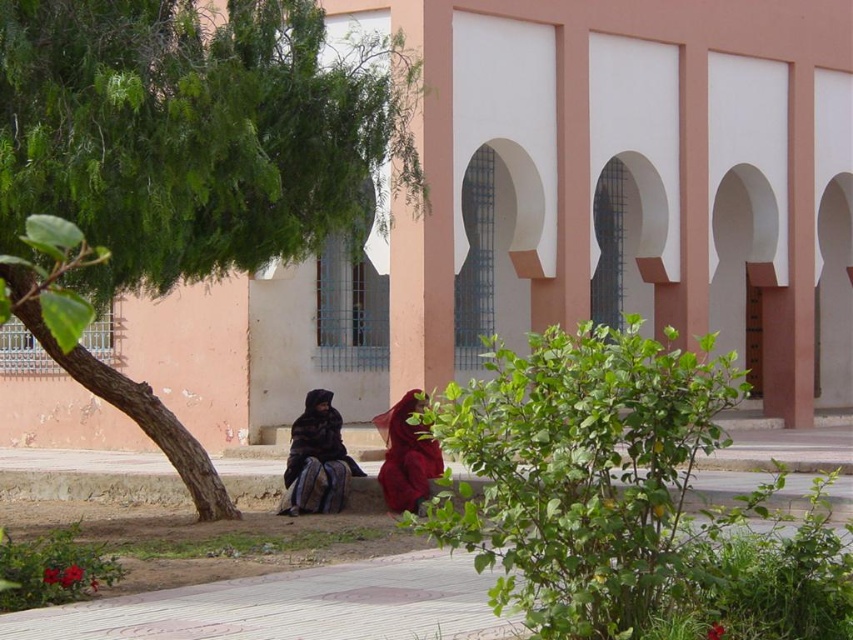
Question: Which point is farther to the camera?

Choices:
 (A) matte red dress at lower center
 (B) dark brown textured fabric at center

Answer: (B)

Question: Is green leafy tree at left in front of matte red dress at lower center?

Choices:
 (A) no
 (B) yes

Answer: (B)

Question: Which object is the closest to the dark brown textured fabric at center?

Choices:
 (A) matte red dress at lower center
 (B) green leafy tree at left

Answer: (A)

Question: Which object is the farthest from the dark brown textured fabric at center?

Choices:
 (A) green leafy tree at left
 (B) matte red dress at lower center

Answer: (A)

Question: Is green leafy tree at left to the left of dark brown textured fabric at center from the viewer's perspective?

Choices:
 (A) yes
 (B) no

Answer: (A)

Question: Is dark brown textured fabric at center smaller than matte red dress at lower center?

Choices:
 (A) yes
 (B) no

Answer: (A)